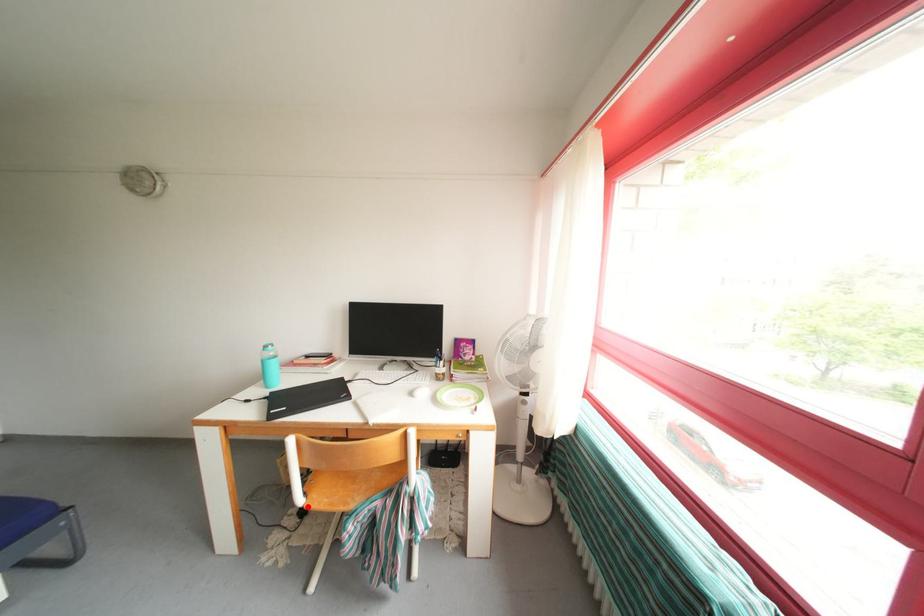
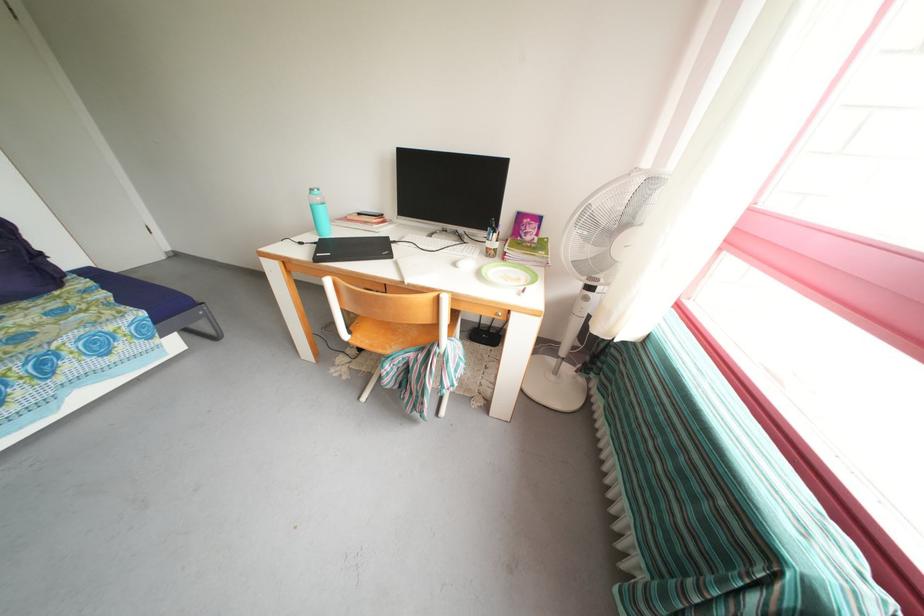
In the second image, find the point that corresponds to the highlighted location in the first image.

(353, 342)